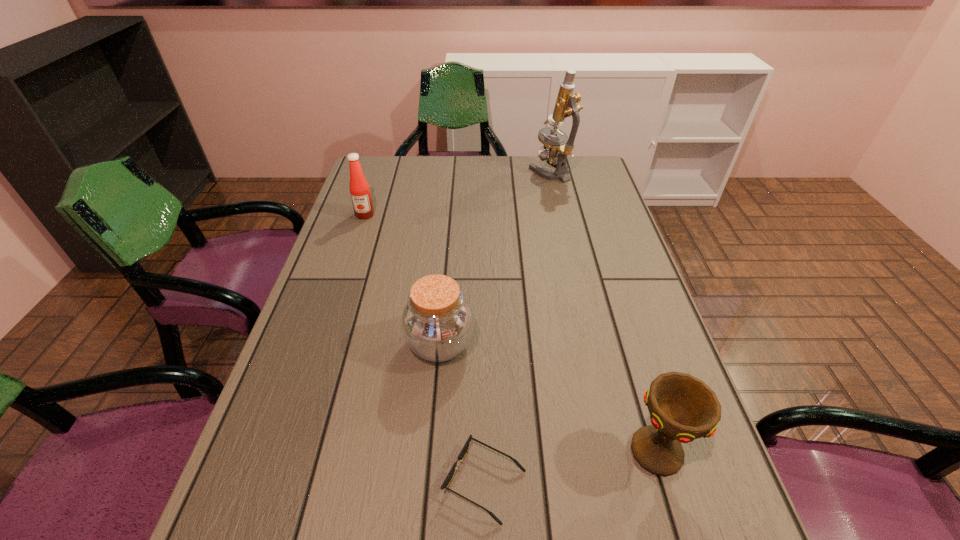
I want to click on vacant point located between the shortest object and the microscope, so click(517, 327).

You are a GUI agent. You are given a task and a screenshot of the screen. Output one action in this format:
    pyautogui.click(x=<x>, y=<y>)
    Task: Click on the vacant area that lies between the sunglasses and the jar
    
    Given the screenshot: What is the action you would take?
    pyautogui.click(x=462, y=413)

Image resolution: width=960 pixels, height=540 pixels. In order to click on vacant space that is in between the microscope and the shortest object in this screenshot , I will do `click(517, 327)`.

In order to click on free space that is in between the chalice and the shortest object in this screenshot , I will do `click(571, 467)`.

Identify which object is the fourth nearest to the jar. Please provide its 2D coordinates. Your answer should be formatted as a tuple, i.e. [(x, y)], where the tuple contains the x and y coordinates of a point satisfying the conditions above.

[(555, 150)]

Identify the location of object that stands as the second closest to the fourth nearest object. (555, 150).

At what (x,y) coordinates should I click in order to perform the action: click on free region that satisfies the following two spatial constraints: 1. on the front side of the chalice; 2. on the lenses of the sunglasses. Please return your answer as a coordinate pair (x, y). The image size is (960, 540). Looking at the image, I should click on (666, 482).

Locate an element on the screen. This screenshot has height=540, width=960. free space that satisfies the following two spatial constraints: 1. on the front side of the microscope; 2. on the left side of the chalice is located at coordinates (614, 451).

Where is `free space in the image that satisfies the following two spatial constraints: 1. on the front-facing side of the jar; 2. on the right side of the leftmost object`? Image resolution: width=960 pixels, height=540 pixels. free space in the image that satisfies the following two spatial constraints: 1. on the front-facing side of the jar; 2. on the right side of the leftmost object is located at coordinates (323, 344).

The image size is (960, 540). In order to click on vacant area in the image that satisfies the following two spatial constraints: 1. on the front-facing side of the fourth nearest object; 2. on the right side of the jar in this screenshot , I will do `click(323, 344)`.